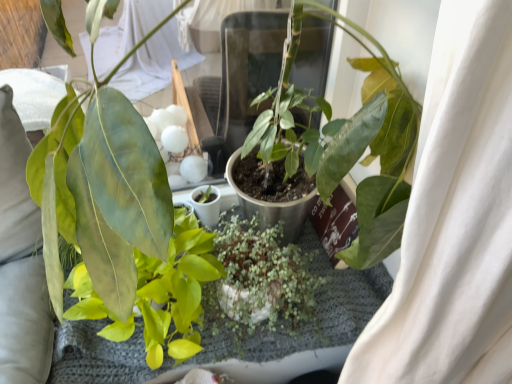
Question: From the image's perspective, relative to green matte succulent at center, the 1th houseplant in the right-to-left sequence, is green glossy leaf at center, positioned as the first houseplant in left-to-right order, above or below?

Choices:
 (A) above
 (B) below

Answer: (A)

Question: In the image, is green glossy leaf at center, positioned as the first houseplant in left-to-right order, on the left side or the right side of green matte succulent at center, the second houseplant viewed from the left?

Choices:
 (A) left
 (B) right

Answer: (A)

Question: Relative to green matte succulent at center, the 1th houseplant in the right-to-left sequence, is green glossy leaf at center, positioned as the first houseplant in left-to-right order, in front or behind?

Choices:
 (A) behind
 (B) front

Answer: (B)

Question: Which is correct: green matte succulent at center, the second houseplant viewed from the left, is inside green glossy leaf at center, which ranks as the 2th houseplant in right-to-left order, or outside of it?

Choices:
 (A) inside
 (B) outside

Answer: (B)

Question: In the image, is green matte succulent at center, the 1th houseplant in the right-to-left sequence, positioned in front of or behind green glossy leaf at center, which ranks as the 2th houseplant in right-to-left order?

Choices:
 (A) behind
 (B) front

Answer: (A)

Question: Is green matte succulent at center, the second houseplant viewed from the left, taller or shorter than green glossy leaf at center, positioned as the first houseplant in left-to-right order?

Choices:
 (A) tall
 (B) short

Answer: (B)

Question: Looking at their shapes, would you say green matte succulent at center, the second houseplant viewed from the left, is wider or thinner than green glossy leaf at center, which ranks as the 2th houseplant in right-to-left order?

Choices:
 (A) thin
 (B) wide

Answer: (A)